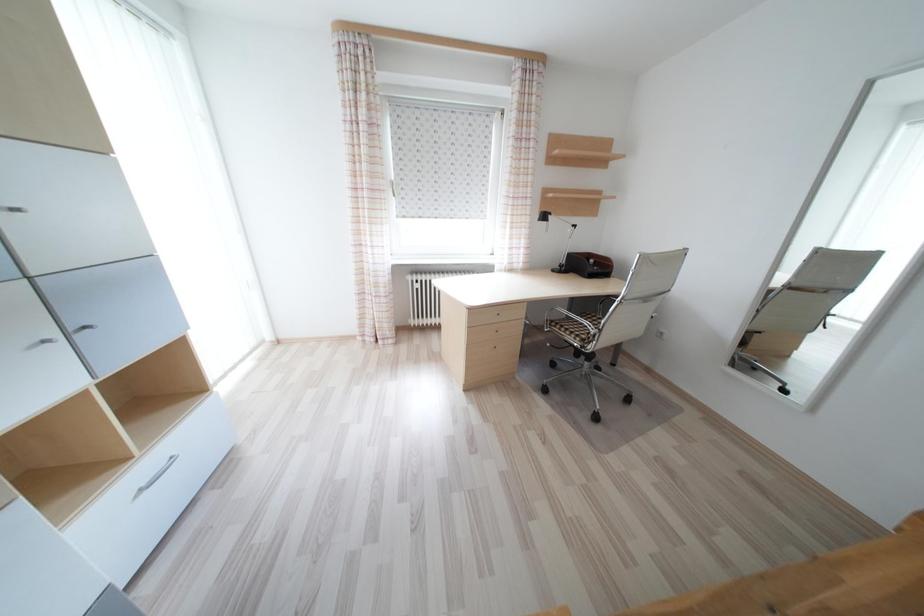
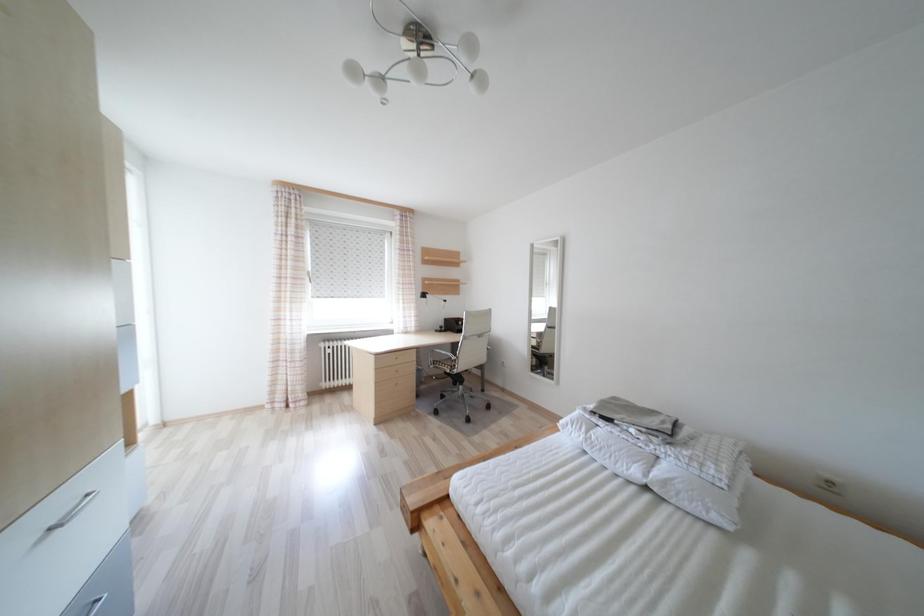
The images are taken continuously from a first-person perspective. In which direction is your viewpoint rotating?

The camera's rotation is toward right-up.